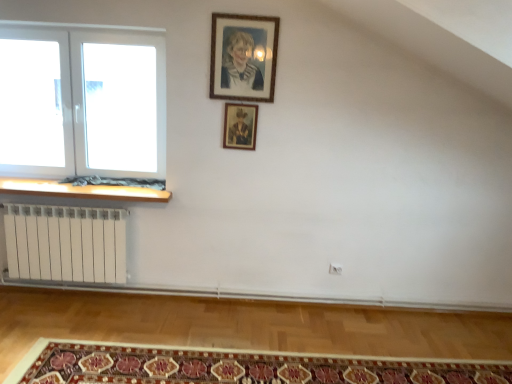
Question: In which direction should I rotate to look at wooden picture frame at upper center, which appears as the second picture frame when viewed from the front?

Choices:
 (A) right
 (B) left

Answer: (B)

Question: Does wooden picture frame at upper center, which is the 1th picture frame from front to back, appear on the right side of white plastic window at left?

Choices:
 (A) yes
 (B) no

Answer: (A)

Question: Considering the relative sizes of wooden picture frame at upper center, the 2th picture frame ordered from the bottom, and white plastic window at left in the image provided, is wooden picture frame at upper center, the 2th picture frame ordered from the bottom, bigger than white plastic window at left?

Choices:
 (A) yes
 (B) no

Answer: (B)

Question: Is wooden picture frame at upper center, which is the 1th picture frame from front to back, surrounding white plastic window at left?

Choices:
 (A) no
 (B) yes

Answer: (A)

Question: Considering the relative sizes of wooden picture frame at upper center, the 2th picture frame when ordered from back to front, and white plastic window at left in the image provided, is wooden picture frame at upper center, the 2th picture frame when ordered from back to front, taller than white plastic window at left?

Choices:
 (A) no
 (B) yes

Answer: (A)

Question: From a real-world perspective, is wooden picture frame at upper center, which is the first picture frame in top-to-bottom order, located beneath white plastic window at left?

Choices:
 (A) yes
 (B) no

Answer: (B)

Question: Is the depth of wooden picture frame at upper center, which is the first picture frame in top-to-bottom order, less than that of white plastic window at left?

Choices:
 (A) no
 (B) yes

Answer: (B)

Question: Is wooden picture frame at upper center, the 1th picture frame positioned from the back, next to wooden at left and touching it?

Choices:
 (A) no
 (B) yes

Answer: (A)

Question: Can you confirm if wooden picture frame at upper center, which is the first picture frame from bottom to top, is bigger than wooden at left?

Choices:
 (A) no
 (B) yes

Answer: (A)

Question: Is the position of wooden picture frame at upper center, the 1th picture frame positioned from the back, less distant than that of wooden at left?

Choices:
 (A) no
 (B) yes

Answer: (B)

Question: Is wooden picture frame at upper center, which appears as the second picture frame when viewed from the front, smaller than wooden at left?

Choices:
 (A) yes
 (B) no

Answer: (A)

Question: Is wooden picture frame at upper center, positioned as the 2th picture frame in top-to-bottom order, turned away from wooden at left?

Choices:
 (A) no
 (B) yes

Answer: (A)

Question: Is wooden picture frame at upper center, the 1th picture frame positioned from the back, positioned beyond the bounds of wooden at left?

Choices:
 (A) no
 (B) yes

Answer: (B)

Question: Considering the relative sizes of wooden at left and wooden picture frame at upper center, the 1th picture frame positioned from the back, in the image provided, is wooden at left wider than wooden picture frame at upper center, the 1th picture frame positioned from the back,?

Choices:
 (A) no
 (B) yes

Answer: (B)